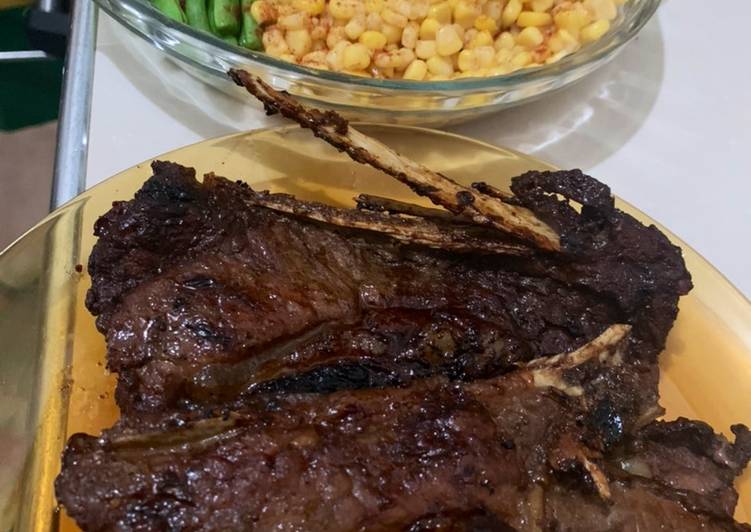
The height and width of the screenshot is (532, 751). In order to click on clear glass bowl in this screenshot , I will do `click(481, 101)`.